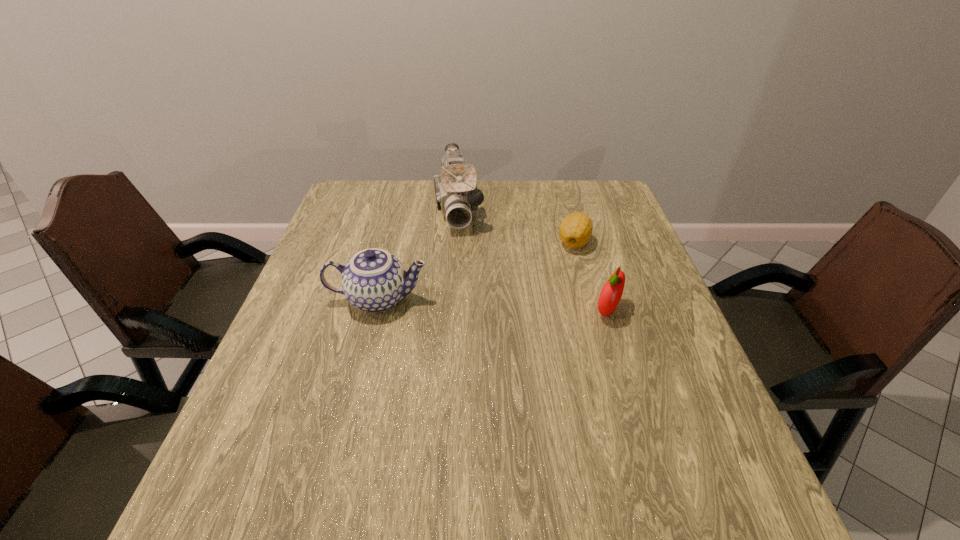
At what (x,y) coordinates should I click in order to perform the action: click on chinaware. Please return your answer as a coordinate pair (x, y). Looking at the image, I should click on (374, 280).

Identify the location of apple. The image size is (960, 540). (611, 293).

The image size is (960, 540). Identify the location of the tallest object. (456, 192).

The height and width of the screenshot is (540, 960). I want to click on lemon, so click(575, 230).

You are a GUI agent. You are given a task and a screenshot of the screen. Output one action in this format:
    pyautogui.click(x=<x>, y=<y>)
    Task: Click on the vacant region located 0.250m from the spout of the chinaware
    The image size is (960, 540).
    Given the screenshot: What is the action you would take?
    pyautogui.click(x=532, y=299)

You are a GUI agent. You are given a task and a screenshot of the screen. Output one action in this format:
    pyautogui.click(x=<x>, y=<y>)
    Task: Click on the blank area located 0.320m on the front of the third tallest object
    Image resolution: width=960 pixels, height=540 pixels.
    Given the screenshot: What is the action you would take?
    click(653, 460)

Identify the location of vacant space located on the front-facing side of the tallest object. (462, 258).

Locate an element on the screen. vacant space situated 0.120m on the front-facing side of the tallest object is located at coordinates (463, 262).

This screenshot has height=540, width=960. I want to click on blank space located 0.280m on the front-facing side of the tallest object, so click(x=468, y=305).

You are a GUI agent. You are given a task and a screenshot of the screen. Output one action in this format:
    pyautogui.click(x=<x>, y=<y>)
    Task: Click on the free space located at the stem end of the lemon
    
    Given the screenshot: What is the action you would take?
    pyautogui.click(x=486, y=317)